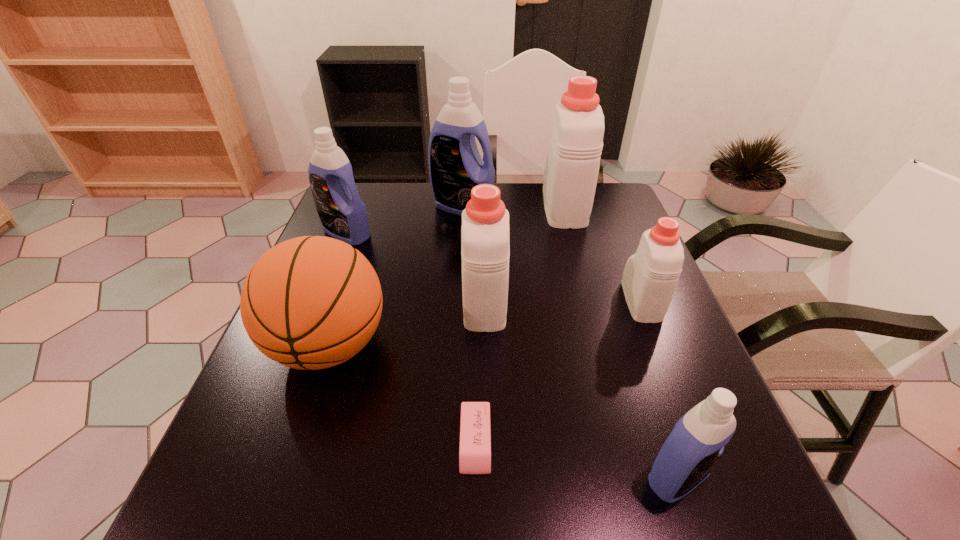
Identify the location of the second white detergent from left to right. This screenshot has height=540, width=960. (571, 171).

Identify the location of the farthest white detergent. 571,171.

Locate an element on the screen. the biggest blue detergent is located at coordinates (455, 165).

Identify the location of the second smallest white detergent. The height and width of the screenshot is (540, 960). (485, 247).

I want to click on the leftmost detergent, so click(343, 215).

You are a GUI agent. You are given a task and a screenshot of the screen. Output one action in this format:
    pyautogui.click(x=<x>, y=<y>)
    Task: Click on the second biggest blue detergent
    This screenshot has width=960, height=540.
    Given the screenshot: What is the action you would take?
    pyautogui.click(x=343, y=215)

Identify the location of orange basketball. This screenshot has width=960, height=540. (312, 302).

Find the location of `the smallest white detergent`. the smallest white detergent is located at coordinates (650, 277).

Locate an element on the screen. the nearest blue detergent is located at coordinates (697, 441).

Where is `the rightmost blue detergent`? The image size is (960, 540). the rightmost blue detergent is located at coordinates (697, 441).